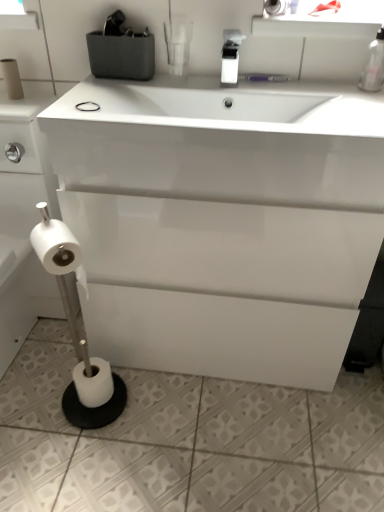
Find the location of a particular element. vacant area in front of white matte toilet paper at left, which is counted as the 4th toilet paper, starting from the right is located at coordinates (14, 106).